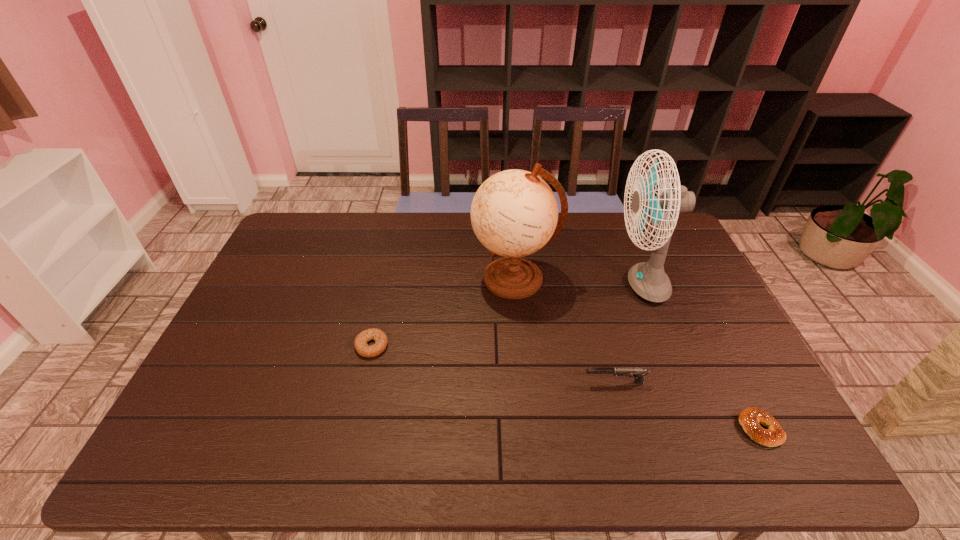
At what (x,y) coordinates should I click in order to perform the action: click on object that stands as the second closest to the globe. Please return your answer as a coordinate pair (x, y). Image resolution: width=960 pixels, height=540 pixels. Looking at the image, I should click on (380, 338).

The width and height of the screenshot is (960, 540). Identify the location of the closest object to the globe. (648, 279).

Locate an element on the screen. The image size is (960, 540). free space that satisfies the following two spatial constraints: 1. at the muzzle end of the nearer bagel; 2. on the left side of the third shortest object is located at coordinates (627, 429).

This screenshot has width=960, height=540. Find the location of `vacant area in the image that satisfies the following two spatial constraints: 1. at the muzzle end of the rightmost object; 2. on the left side of the fourth farthest object`. vacant area in the image that satisfies the following two spatial constraints: 1. at the muzzle end of the rightmost object; 2. on the left side of the fourth farthest object is located at coordinates (627, 429).

You are a GUI agent. You are given a task and a screenshot of the screen. Output one action in this format:
    pyautogui.click(x=<x>, y=<y>)
    Task: Click on the free space that satisfies the following two spatial constraints: 1. on the back side of the nearest object; 2. at the muzzle end of the fourth farthest object
    The height and width of the screenshot is (540, 960).
    Given the screenshot: What is the action you would take?
    pyautogui.click(x=736, y=383)

Locate an element on the screen. free space that satisfies the following two spatial constraints: 1. on the surface of the rightmost object; 2. on the left side of the fourth object from right to left is located at coordinates click(528, 429).

Find the location of a particular element. The height and width of the screenshot is (540, 960). free region that satisfies the following two spatial constraints: 1. on the surface of the nearer bagel; 2. on the left side of the globe is located at coordinates (528, 429).

Image resolution: width=960 pixels, height=540 pixels. What are the coordinates of `vacant space that satisfies the following two spatial constraints: 1. on the back side of the nearest object; 2. on the front-facing side of the fan` in the screenshot? It's located at (686, 285).